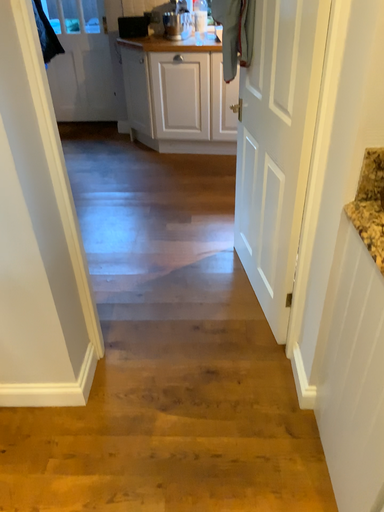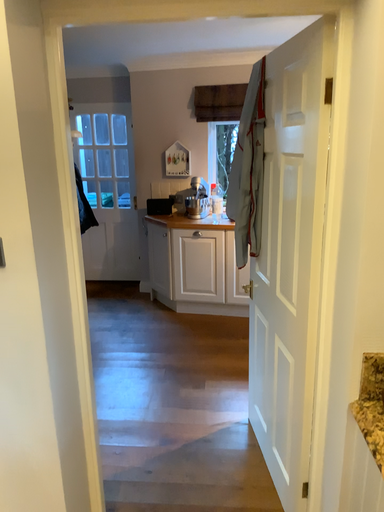
Question: Which way did the camera rotate in the video?

Choices:
 (A) rotated downward
 (B) rotated upward

Answer: (B)